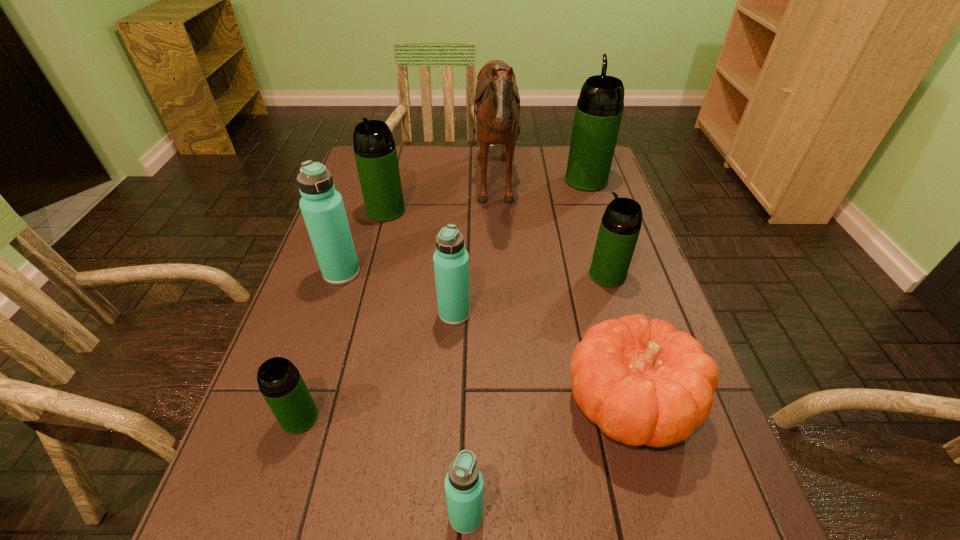
The width and height of the screenshot is (960, 540). Find the location of `thermos bottle situated at the far edge`. thermos bottle situated at the far edge is located at coordinates (599, 109).

You are a GUI agent. You are given a task and a screenshot of the screen. Output one action in this format:
    pyautogui.click(x=<x>, y=<y>)
    Task: Click on the object that is at the near edge
    
    Given the screenshot: What is the action you would take?
    [x=463, y=483]

Find the location of a particular element. pumpkin situated at the right edge is located at coordinates (641, 382).

I want to click on object that is at the far right corner, so click(x=599, y=109).

Identify the location of vacant region at the far edge of the desktop. The height and width of the screenshot is (540, 960). (500, 160).

I want to click on vacant area at the left edge of the desktop, so click(358, 300).

I want to click on vacant region at the right edge of the desktop, so click(596, 213).

Identify the location of free space between the third biggest green thermos bottle and the leftmost aqua thermos bottle. (474, 274).

You are a GUI agent. You are given a task and a screenshot of the screen. Output one action in this format:
    pyautogui.click(x=<x>, y=<y>)
    Task: Click on the vacant space that's between the orange pumpkin and the smallest aqua thermos bottle
    This screenshot has width=960, height=540.
    Given the screenshot: What is the action you would take?
    pyautogui.click(x=548, y=459)

Locate an element on the screen. The height and width of the screenshot is (540, 960). free point between the farthest aqua thermos bottle and the saddle is located at coordinates (419, 231).